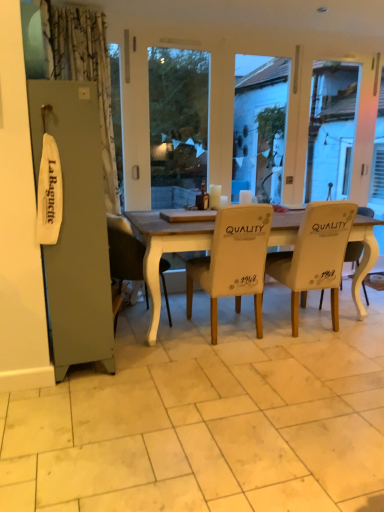
What are the coordinates of `vacant space underneath white leather chair at center, the 2th chair positioned from the left (from a real-world perspective)` in the screenshot? It's located at (225, 331).